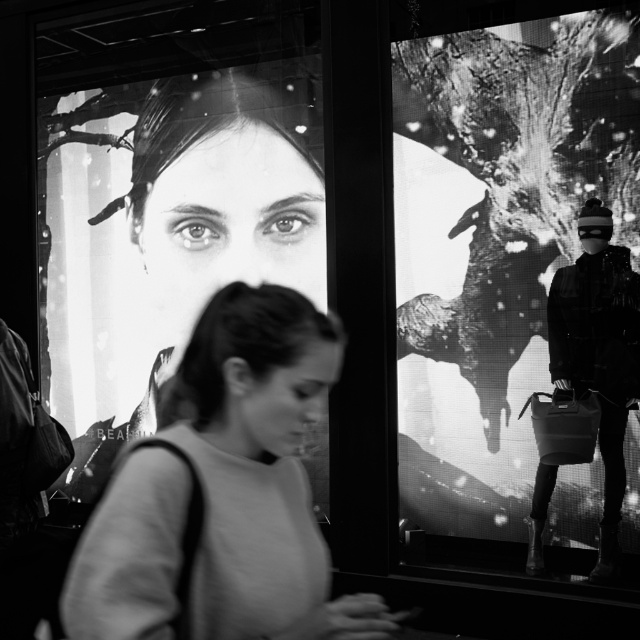
You are a photographer standing at the camera position. You want to take a closeup of the smooth skin face at center. Can you move closer to take the photo without exceeding the minimum focusing distance of your camera, which is 2.5 meters?

The smooth skin face at center is 3.60 meters away from the camera. Since the minimum focusing distance is 2.5 meters, you can move closer to 2.5 meters to take the photo as it is within the allowable range.

You are standing in front of the two screens. You want to touch the smooth gray sweater at center. Which direction should you move to reach it?

The smooth gray sweater at center is located at the center of the image, so you should move forward towards the center to reach it.